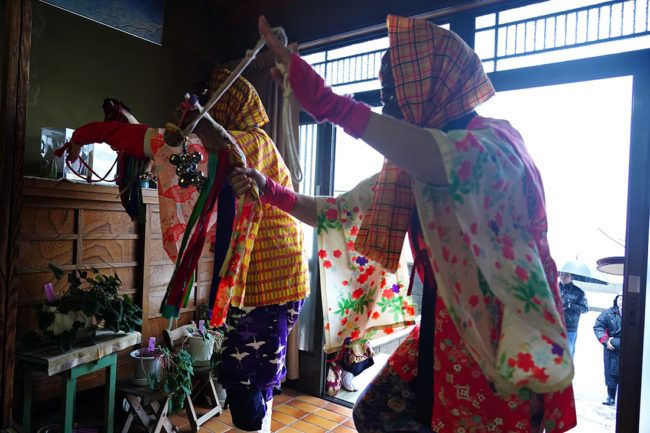
What are the coordinates of `plant vase` in the screenshot? It's located at (140, 369), (198, 352).